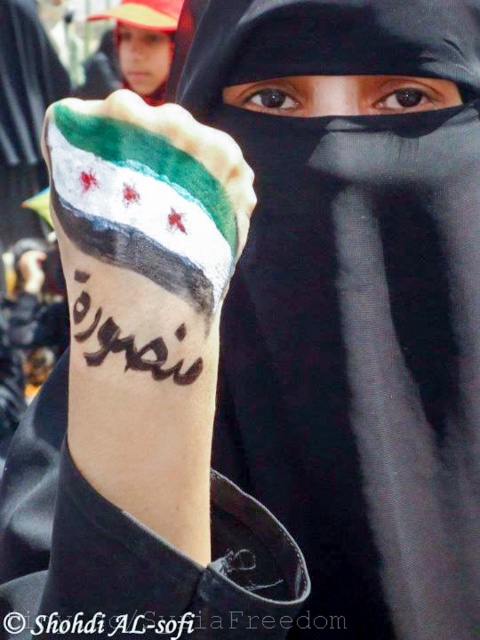
Question: Is black matte niqab at center bigger than smooth skin face at upper left?

Choices:
 (A) yes
 (B) no

Answer: (B)

Question: Can you confirm if black matte niqab at center is positioned to the right of smooth skin face at upper left?

Choices:
 (A) no
 (B) yes

Answer: (B)

Question: Estimate the real-world distances between objects in this image. Which object is closer to the smooth skin face at upper left?

Choices:
 (A) black ink writing at center
 (B) black matte niqab at center

Answer: (B)

Question: Is black ink writing at center above black matte niqab at center?

Choices:
 (A) no
 (B) yes

Answer: (A)

Question: Which point appears farthest from the camera in this image?

Choices:
 (A) (192, 618)
 (B) (418, 83)
 (C) (140, 36)

Answer: (C)

Question: Which point is farther to the camera?

Choices:
 (A) (338, 104)
 (B) (168, 61)
 (C) (167, 627)

Answer: (B)